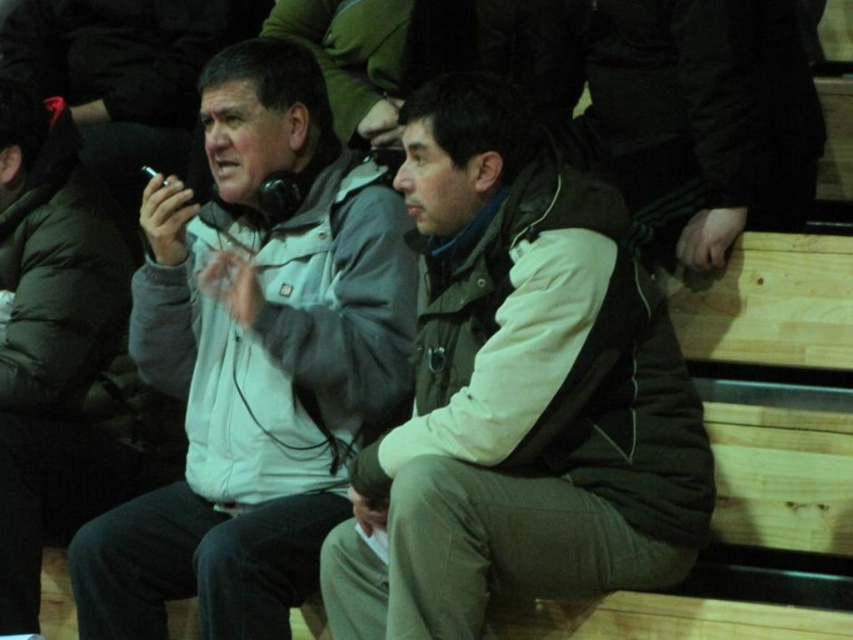
How distant is gray matte jacket at center from matte gray jacket at left?

gray matte jacket at center and matte gray jacket at left are 17.34 inches apart from each other.

Is gray matte jacket at center wider than matte gray jacket at left?

Yes.

Is point (317, 356) farther from viewer compared to point (71, 221)?

No, it is in front of (71, 221).

The height and width of the screenshot is (640, 853). I want to click on gray matte jacket at center, so click(254, 360).

Does point (479, 396) come closer to viewer compared to point (15, 360)?

Yes, it is in front of point (15, 360).

How distant is matte brown jacket at center from matte gray jacket at left?

matte brown jacket at center and matte gray jacket at left are 1.07 meters apart.

You are a GUI agent. You are given a task and a screenshot of the screen. Output one action in this format:
    pyautogui.click(x=<x>, y=<y>)
    Task: Click on the matte brown jacket at center
    
    Given the screenshot: What is the action you would take?
    pyautogui.click(x=519, y=394)

Does point (618, 300) come closer to viewer compared to point (350, 364)?

Yes, it is.

Who is shorter, matte brown jacket at center or gray matte jacket at center?

matte brown jacket at center

Does point (457, 157) lie behind point (299, 147)?

No.

I want to click on matte brown jacket at center, so click(x=519, y=394).